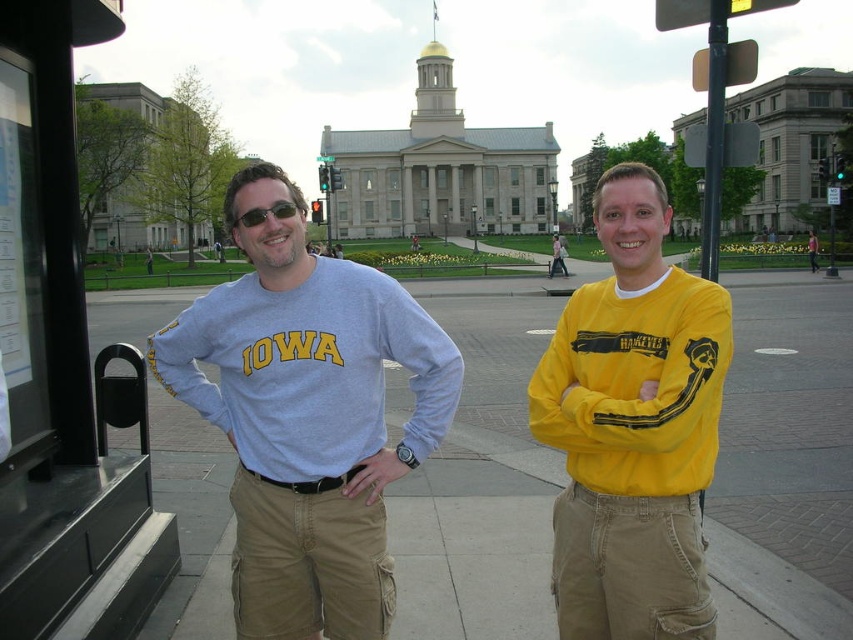
Does light blue cotton shirt at center have a greater width compared to yellow matte long-sleeve shirt at center?

Yes, light blue cotton shirt at center is wider than yellow matte long-sleeve shirt at center.

Is light blue cotton shirt at center positioned in front of yellow matte long-sleeve shirt at center?

No, light blue cotton shirt at center is further to the viewer.

Is point (294, 300) in front of point (602, 432)?

No, it is behind (602, 432).

Locate an element on the screen. light blue cotton shirt at center is located at coordinates (306, 417).

Does light blue cotton shirt at center appear over matte gray shirt at center?

No, light blue cotton shirt at center is not above matte gray shirt at center.

Who is taller, light blue cotton shirt at center or matte gray shirt at center?

light blue cotton shirt at center is taller.

Which is behind, point (268, 268) or point (329, 257)?

Positioned behind is point (329, 257).

Identify the location of light blue cotton shirt at center. (306, 417).

Between metallic bus stop at left and matte black sunglasses at center, which one is positioned higher?

matte black sunglasses at center is above.

Who is lower down, metallic bus stop at left or matte black sunglasses at center?

metallic bus stop at left is below.

Between point (59, 54) and point (265, 211), which one is positioned behind?

Point (265, 211)

Find the location of a particular element. Image resolution: width=853 pixels, height=640 pixels. metallic bus stop at left is located at coordinates [62, 365].